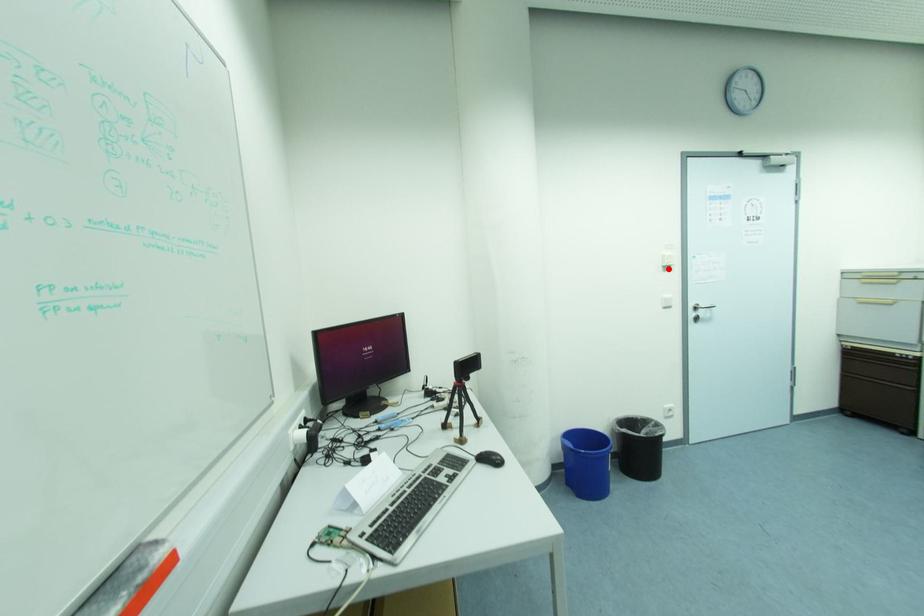
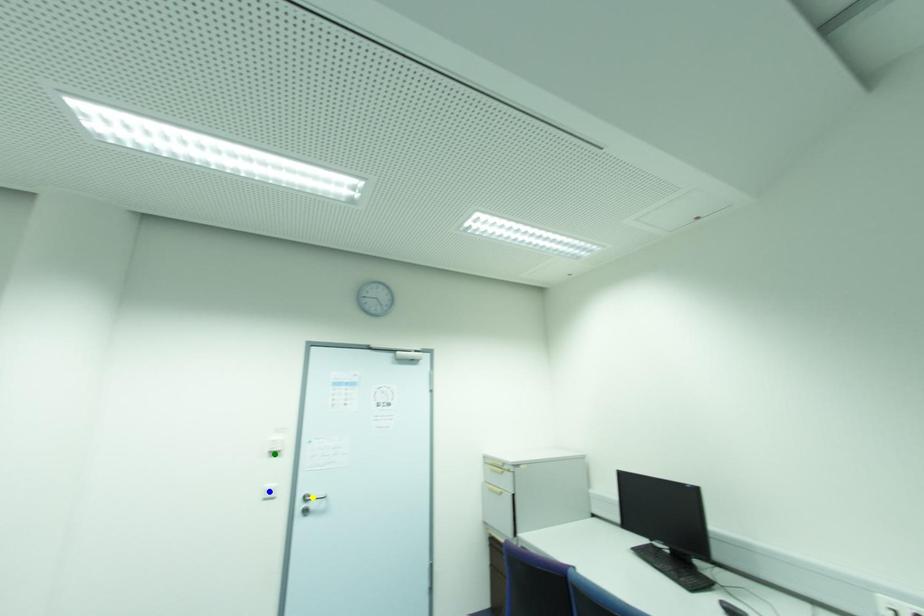
Question: I am providing you with two images of the same scene from different viewpoints. A red point is marked on the first image. You are given multiple points on the second image. In image 2, which mark is for the same physical point as the one in image 1?

Choices:
 (A) blue point
 (B) green point
 (C) yellow point

Answer: (B)